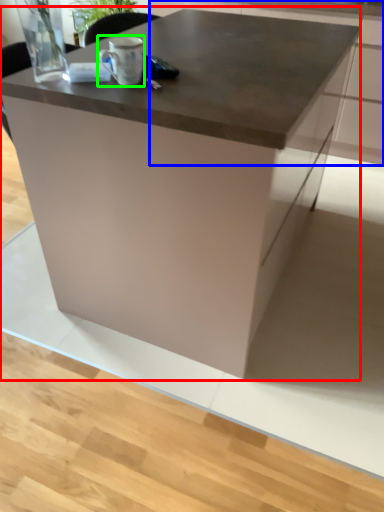
Question: Based on their relative distances, which object is nearer to table (highlighted by a red box)? Choose from cabinetry (highlighted by a blue box) and coffee cup (highlighted by a green box).

Choices:
 (A) cabinetry
 (B) coffee cup

Answer: (B)